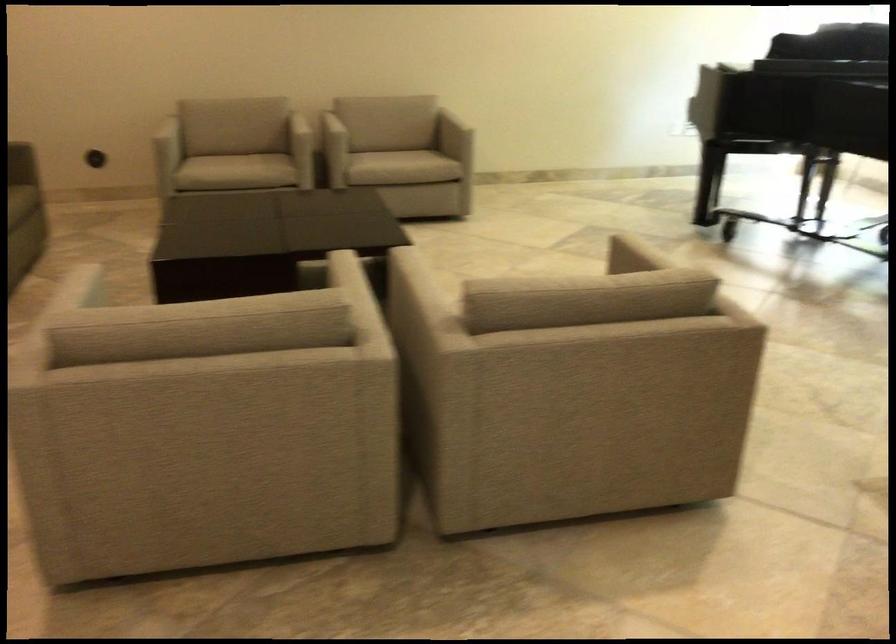
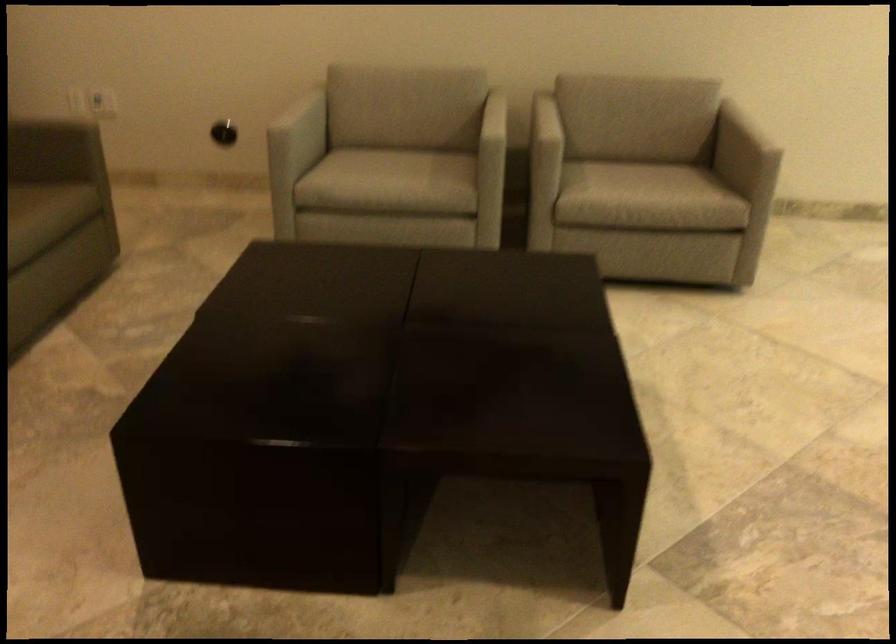
Question: What movement of the cameraman would produce the second image?

Choices:
 (A) Left
 (B) Right
 (C) Forward
 (D) Backward

Answer: (C)